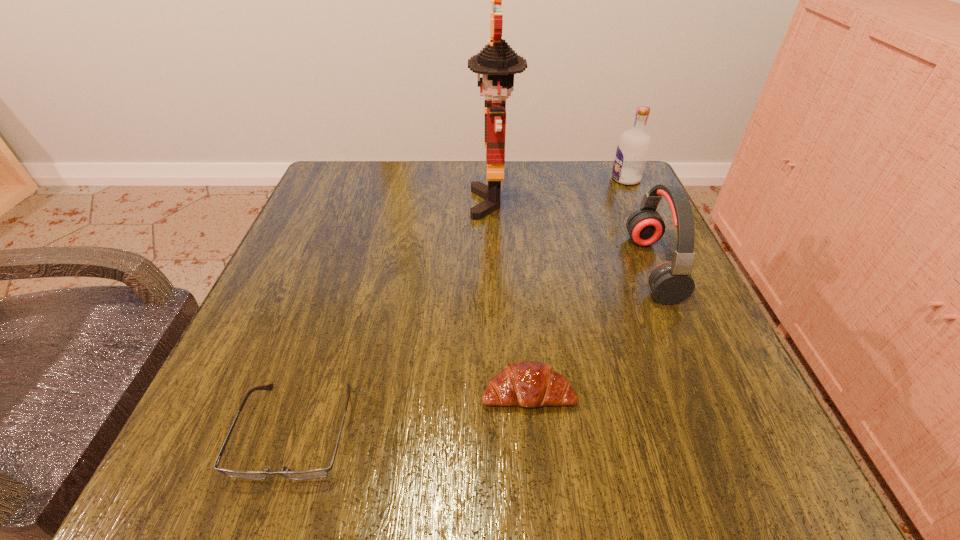
Identify the location of vacant area that lies between the nutcracker and the leftmost object. The width and height of the screenshot is (960, 540). (395, 317).

Where is `unoccupied position between the earphone and the tallest object`? The image size is (960, 540). unoccupied position between the earphone and the tallest object is located at coordinates (573, 235).

The width and height of the screenshot is (960, 540). Identify the location of vacant region between the tallest object and the second shortest object. (511, 298).

The width and height of the screenshot is (960, 540). Find the location of `free space between the leftmost object and the crescent roll`. free space between the leftmost object and the crescent roll is located at coordinates (412, 411).

Where is `empty space between the spectacles and the fourth tallest object`? This screenshot has height=540, width=960. empty space between the spectacles and the fourth tallest object is located at coordinates (412, 411).

Identify the location of free space between the shortest object and the fourth tallest object. [412, 411].

Locate an element on the screen. This screenshot has height=540, width=960. free space between the leftmost object and the vodka is located at coordinates (461, 305).

The image size is (960, 540). In order to click on object identified as the second closest to the vodka in this screenshot , I will do `click(497, 62)`.

Image resolution: width=960 pixels, height=540 pixels. What are the coordinates of `object that stands as the third closest to the tallest object` in the screenshot? It's located at (530, 384).

This screenshot has height=540, width=960. I want to click on vacant position in the image that satisfies the following two spatial constraints: 1. on the front-facing side of the tallest object; 2. on the back side of the fourth tallest object, so click(x=501, y=392).